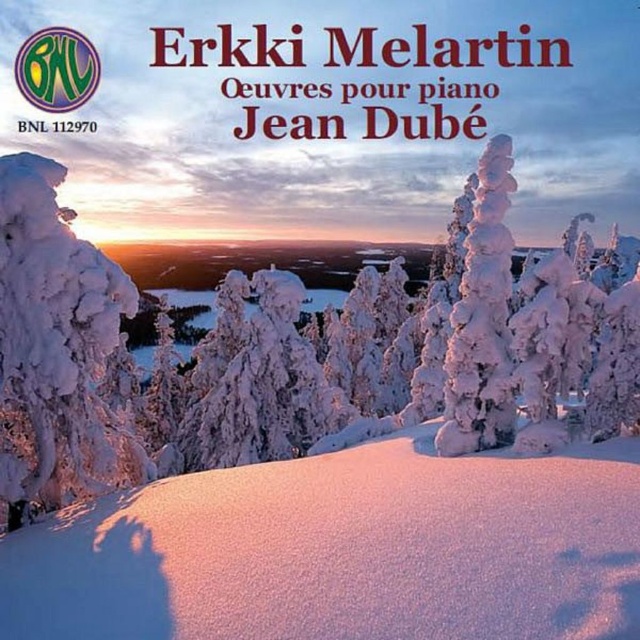
Which is below, white fluffy snow at center or white frosty tree at left?

Positioned lower is white fluffy snow at center.

Does white fluffy snow at center have a greater height compared to white frosty tree at left?

Indeed, white fluffy snow at center has a greater height compared to white frosty tree at left.

The image size is (640, 640). I want to click on white fluffy snow at center, so click(346, 552).

In order to click on white fluffy snow at center in this screenshot , I will do pos(346,552).